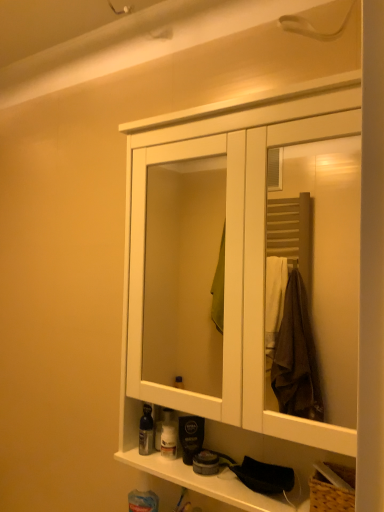
This screenshot has width=384, height=512. I want to click on translucent plastic bottle at lower center, the 2th toiletry from the left, so click(x=168, y=435).

What do you see at coordinates (168, 435) in the screenshot? I see `translucent plastic bottle at lower center, which is counted as the 1th toiletry, starting from the right` at bounding box center [168, 435].

Locate an element on the screen. This screenshot has width=384, height=512. white wood cabinet at center is located at coordinates (254, 281).

The width and height of the screenshot is (384, 512). What do you see at coordinates (254, 281) in the screenshot?
I see `white wood cabinet at center` at bounding box center [254, 281].

Locate an element on the screen. Image resolution: width=384 pixels, height=512 pixels. translucent plastic bottle at lower center, which is counted as the 1th toiletry, starting from the right is located at coordinates (168, 435).

Which is behind, shiny silver bottle at lower left, positioned as the first toiletry in left-to-right order, or white wood cabinet at center?

shiny silver bottle at lower left, positioned as the first toiletry in left-to-right order, is further from the camera.

Is white wood cabinet at center at the back of shiny silver bottle at lower left, positioned as the first toiletry in left-to-right order?

Correct, shiny silver bottle at lower left, positioned as the first toiletry in left-to-right order, is looking away from white wood cabinet at center.

Identify the location of cabinetry above the shiny silver bottle at lower left, acting as the 2th toiletry starting from the right (from a real-world perspective). (254, 281).

How much distance is there between shiny silver bottle at lower left, positioned as the first toiletry in left-to-right order, and white wood cabinet at center?

A distance of 5.76 feet exists between shiny silver bottle at lower left, positioned as the first toiletry in left-to-right order, and white wood cabinet at center.

From a real-world perspective, which is physically below, translucent plastic bottle at lower center, the 2th toiletry from the left, or shiny silver bottle at lower left, acting as the 2th toiletry starting from the right?

translucent plastic bottle at lower center, the 2th toiletry from the left, from a real-world perspective.

You are a GUI agent. You are given a task and a screenshot of the screen. Output one action in this format:
    pyautogui.click(x=<x>, y=<y>)
    Task: Click on the toiletry located above the translucent plastic bottle at lower center, the 2th toiletry from the left (from a real-world perspective)
    The height and width of the screenshot is (512, 384).
    Given the screenshot: What is the action you would take?
    pyautogui.click(x=146, y=431)

Looking at this image, can you confirm if translucent plastic bottle at lower center, which is counted as the 1th toiletry, starting from the right, is bigger than shiny silver bottle at lower left, acting as the 2th toiletry starting from the right?

Indeed, translucent plastic bottle at lower center, which is counted as the 1th toiletry, starting from the right, has a larger size compared to shiny silver bottle at lower left, acting as the 2th toiletry starting from the right.

How different are the orientations of translucent plastic bottle at lower center, the 2th toiletry from the left, and shiny silver bottle at lower left, acting as the 2th toiletry starting from the right, in degrees?

They differ by 6.64e-05 degrees in their facing directions.

Which is more to the left, translucent plastic bottle at lower center, the 2th toiletry from the left, or white wood cabinet at center?

From the viewer's perspective, translucent plastic bottle at lower center, the 2th toiletry from the left, appears more on the left side.

Considering the sizes of objects translucent plastic bottle at lower center, which is counted as the 1th toiletry, starting from the right, and white wood cabinet at center in the image provided, who is wider, translucent plastic bottle at lower center, which is counted as the 1th toiletry, starting from the right, or white wood cabinet at center?

Wider between the two is white wood cabinet at center.

From the image's perspective, is translucent plastic bottle at lower center, which is counted as the 1th toiletry, starting from the right, positioned above or below white wood cabinet at center?

From the image's perspective, translucent plastic bottle at lower center, which is counted as the 1th toiletry, starting from the right, appears below white wood cabinet at center.

Is shiny silver bottle at lower left, acting as the 2th toiletry starting from the right, in front of or behind translucent plastic bottle at lower center, the 2th toiletry from the left, in the image?

Visually, shiny silver bottle at lower left, acting as the 2th toiletry starting from the right, is located in front of translucent plastic bottle at lower center, the 2th toiletry from the left.

Between shiny silver bottle at lower left, positioned as the first toiletry in left-to-right order, and translucent plastic bottle at lower center, which is counted as the 1th toiletry, starting from the right, which one has less height?

shiny silver bottle at lower left, positioned as the first toiletry in left-to-right order.

Are shiny silver bottle at lower left, acting as the 2th toiletry starting from the right, and translucent plastic bottle at lower center, which is counted as the 1th toiletry, starting from the right, making contact?

Yes, shiny silver bottle at lower left, acting as the 2th toiletry starting from the right, is beside translucent plastic bottle at lower center, which is counted as the 1th toiletry, starting from the right.

Which is closer to the camera, (141, 451) or (169, 411)?

The point (169, 411) is closer.

Looking at this image, measure the distance between white wood cabinet at center and shiny silver bottle at lower left, positioned as the first toiletry in left-to-right order.

white wood cabinet at center and shiny silver bottle at lower left, positioned as the first toiletry in left-to-right order, are 5.76 feet apart from each other.

At what (x,y) coordinates should I click in order to perform the action: click on cabinetry located on the right of shiny silver bottle at lower left, acting as the 2th toiletry starting from the right. Please return your answer as a coordinate pair (x, y). Image resolution: width=384 pixels, height=512 pixels. Looking at the image, I should click on (254, 281).

Does white wood cabinet at center have a lesser width compared to shiny silver bottle at lower left, acting as the 2th toiletry starting from the right?

No.

Is white wood cabinet at center oriented away from translucent plastic bottle at lower center, which is counted as the 1th toiletry, starting from the right?

That's right, white wood cabinet at center is facing away from translucent plastic bottle at lower center, which is counted as the 1th toiletry, starting from the right.

From a real-world perspective, is white wood cabinet at center below translucent plastic bottle at lower center, the 2th toiletry from the left?

No.

Would you consider white wood cabinet at center to be distant from translucent plastic bottle at lower center, which is counted as the 1th toiletry, starting from the right?

Yes, white wood cabinet at center is far from translucent plastic bottle at lower center, which is counted as the 1th toiletry, starting from the right.

From the image's perspective, count 1st toiletrys downward from the white wood cabinet at center and point to it. Please provide its 2D coordinates.

[(146, 431)]

Locate an element on the screen. toiletry above the translucent plastic bottle at lower center, the 2th toiletry from the left (from the image's perspective) is located at coordinates (146, 431).

Based on their spatial positions, is white wood cabinet at center or translucent plastic bottle at lower center, the 2th toiletry from the left, closer to shiny silver bottle at lower left, acting as the 2th toiletry starting from the right?

The object closer to shiny silver bottle at lower left, acting as the 2th toiletry starting from the right, is translucent plastic bottle at lower center, the 2th toiletry from the left.

Estimate the real-world distances between objects in this image. Which object is closer to white wood cabinet at center, shiny silver bottle at lower left, acting as the 2th toiletry starting from the right, or translucent plastic bottle at lower center, the 2th toiletry from the left?

shiny silver bottle at lower left, acting as the 2th toiletry starting from the right, is closer to white wood cabinet at center.

Looking at the image, which one is located closer to white wood cabinet at center, translucent plastic bottle at lower center, the 2th toiletry from the left, or shiny silver bottle at lower left, positioned as the first toiletry in left-to-right order?

Based on the image, shiny silver bottle at lower left, positioned as the first toiletry in left-to-right order, appears to be nearer to white wood cabinet at center.

From the image, which object appears to be farther from translucent plastic bottle at lower center, which is counted as the 1th toiletry, starting from the right, white wood cabinet at center or shiny silver bottle at lower left, acting as the 2th toiletry starting from the right?

white wood cabinet at center is further to translucent plastic bottle at lower center, which is counted as the 1th toiletry, starting from the right.

Looking at the image, which one is located further to shiny silver bottle at lower left, positioned as the first toiletry in left-to-right order, translucent plastic bottle at lower center, the 2th toiletry from the left, or white wood cabinet at center?

white wood cabinet at center.

From the image, which object appears to be nearer to translucent plastic bottle at lower center, which is counted as the 1th toiletry, starting from the right, shiny silver bottle at lower left, positioned as the first toiletry in left-to-right order, or white wood cabinet at center?

Among the two, shiny silver bottle at lower left, positioned as the first toiletry in left-to-right order, is located nearer to translucent plastic bottle at lower center, which is counted as the 1th toiletry, starting from the right.

You are a GUI agent. You are given a task and a screenshot of the screen. Output one action in this format:
    pyautogui.click(x=<x>, y=<y>)
    Task: Click on the toiletry between white wood cabinet at center and translucent plastic bottle at lower center, which is counted as the 1th toiletry, starting from the right, in the vertical direction
    Image resolution: width=384 pixels, height=512 pixels.
    Given the screenshot: What is the action you would take?
    pyautogui.click(x=146, y=431)